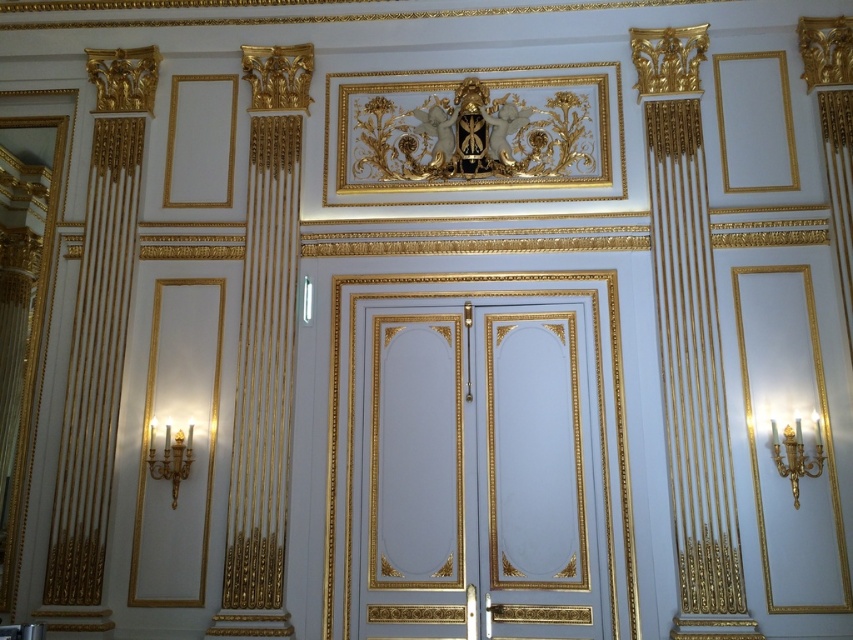
You are an interior designer planning to install a new lighting fixture that requires a minimum of 6 meters of clearance between existing chandeliers. Based on the scene, will the gold metallic chandelier at right and the gold metallic chandelier at lower left meet this requirement?

The gold metallic chandelier at right is 5.53 meters from the gold metallic chandelier at lower left. Since the required clearance is 6 meters, the distance is insufficient to meet the requirement.

You are an interior designer planning to hang a new painting. The painting is 1 meter wide and needs to be centered between the gold metallic chandelier at right and the left edge of the wall. What is the minimum width of the wall required to accommodate this arrangement?

The gold metallic chandelier at right is positioned at 0.711 on the horizontal axis. To center the 1m wide painting between the chandelier and the left edge, the total wall width must be at least 0.711 meters plus half of the painting width, which is 0.5 meters, totaling 1.211 meters. Thus, the minimum wall width required is 1.211 meters.

You are an interior designer examining the wall from a distance. You notice two points on the wall marked at coordinates point (801, 445) and point (171, 449). Which of these points appears closer to your viewpoint?

Point (801, 445) is closer to the camera than point (171, 449), so the point (801, 445) appears closer to your viewpoint.